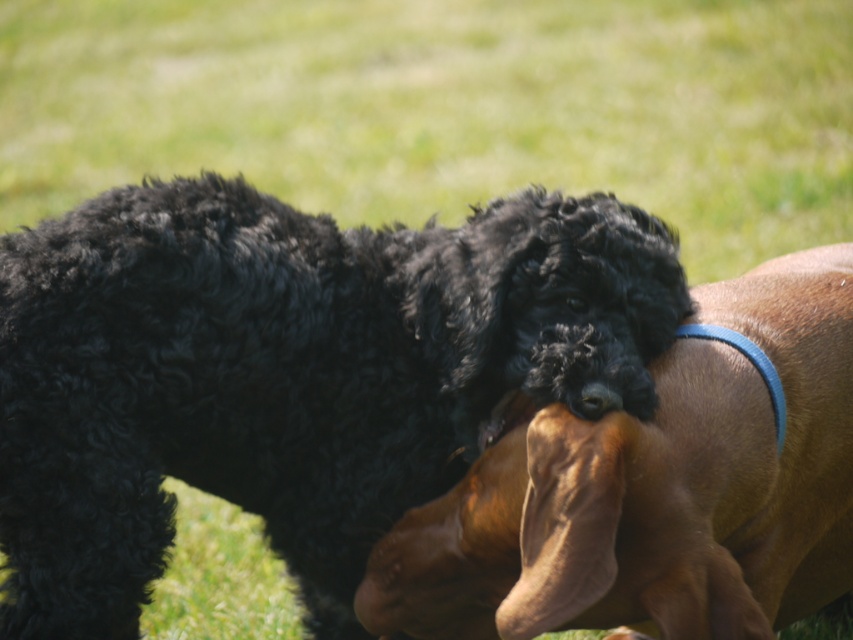
In the scene shown: Can you confirm if black curly fur dog at center is smaller than black curly fur at center?

Yes, black curly fur dog at center is smaller than black curly fur at center.

Between point (341, 593) and point (773, 307), which one is positioned in front?

Point (341, 593) is in front.

Where is `black curly fur dog at center`? This screenshot has width=853, height=640. black curly fur dog at center is located at coordinates (288, 374).